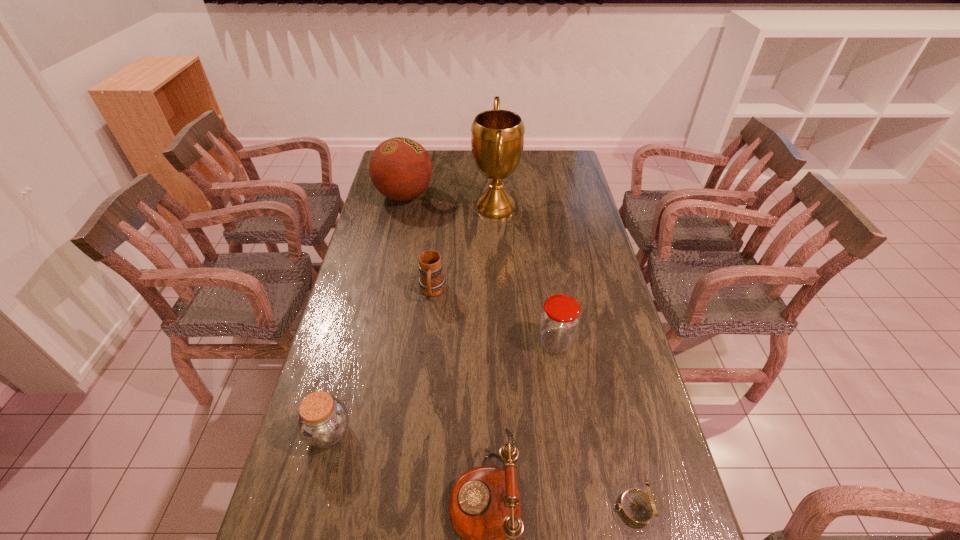
Where is `vacant area that lies between the fourth nearest object and the trophy cup`? This screenshot has height=540, width=960. vacant area that lies between the fourth nearest object and the trophy cup is located at coordinates (526, 274).

Select which object is the fourth closest to the shortest object. Please provide its 2D coordinates. Your answer should be formatted as a tuple, i.e. [(x, y)], where the tuple contains the x and y coordinates of a point satisfying the conditions above.

[(431, 282)]

Identify which object is the fifth nearest to the taller jar. Please provide its 2D coordinates. Your answer should be formatted as a tuple, i.e. [(x, y)], where the tuple contains the x and y coordinates of a point satisfying the conditions above.

[(323, 419)]

Identify the location of vacant space that satisfies the following two spatial constraints: 1. on the side of the farther jar with the handle; 2. on the left side of the third farthest object. (427, 342).

Find the location of a particular element. The height and width of the screenshot is (540, 960). vacant space that satisfies the following two spatial constraints: 1. on the surface of the trophy cup with symbols; 2. on the back side of the farther jar is located at coordinates pos(502,342).

The height and width of the screenshot is (540, 960). Find the location of `free space in the image that satisfies the following two spatial constraints: 1. on the back side of the shorter jar; 2. on the right side of the basketball`. free space in the image that satisfies the following two spatial constraints: 1. on the back side of the shorter jar; 2. on the right side of the basketball is located at coordinates (390, 196).

At what (x,y) coordinates should I click in order to perform the action: click on free region that satisfies the following two spatial constraints: 1. on the side of the right jar with the handle; 2. on the left side of the mug. Please return your answer as a coordinate pair (x, y). Looking at the image, I should click on (427, 342).

Identify the location of free location that satisfies the following two spatial constraints: 1. on the back side of the sixth shortest object; 2. on the left side of the shorter jar. pos(390,196).